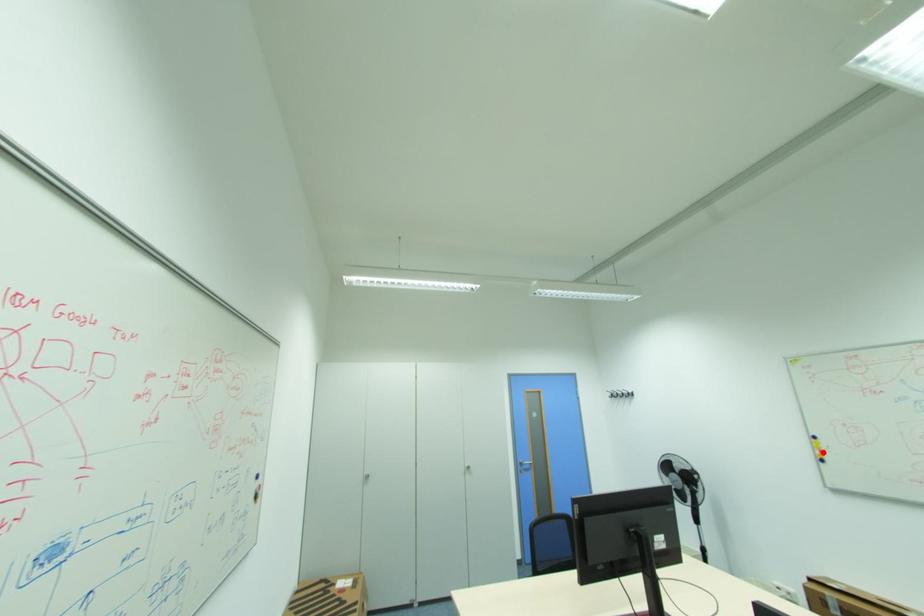
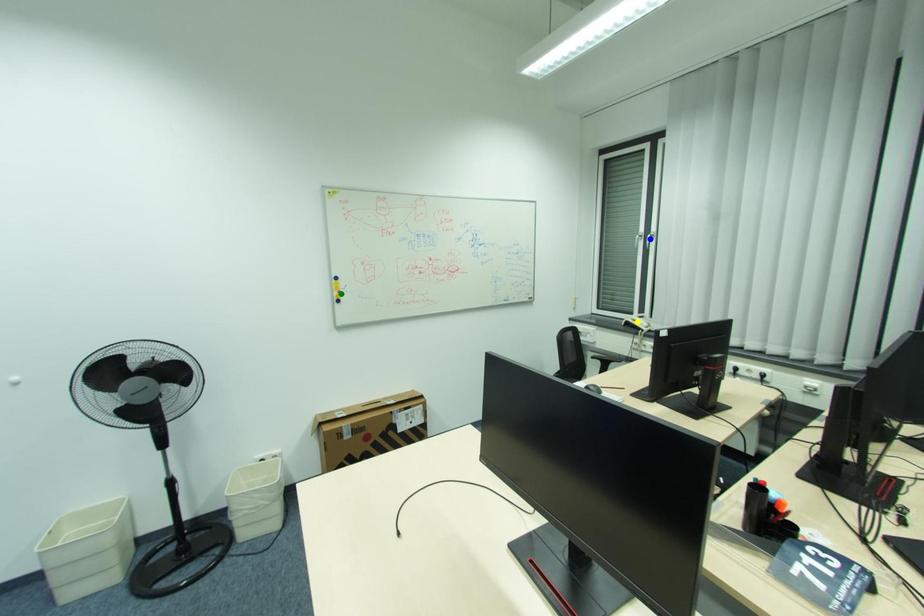
Question: I am providing you with two images of the same scene from different viewpoints. A red point is marked on the first image. You are given multiple points on the second image. Can you choose the point in image 2 that corresponds to the point in image 1?

Choices:
 (A) green point
 (B) yellow point
 (C) blue point

Answer: (A)